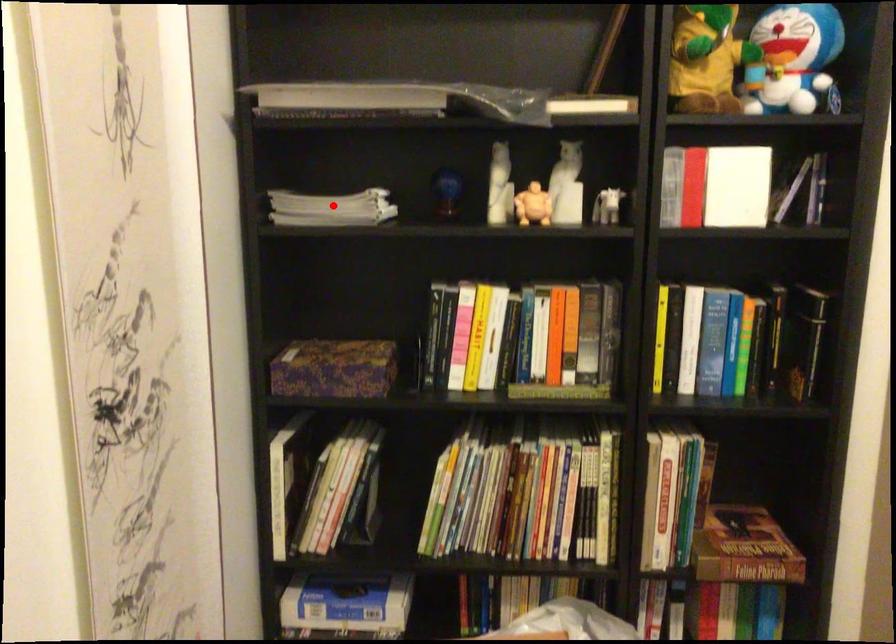
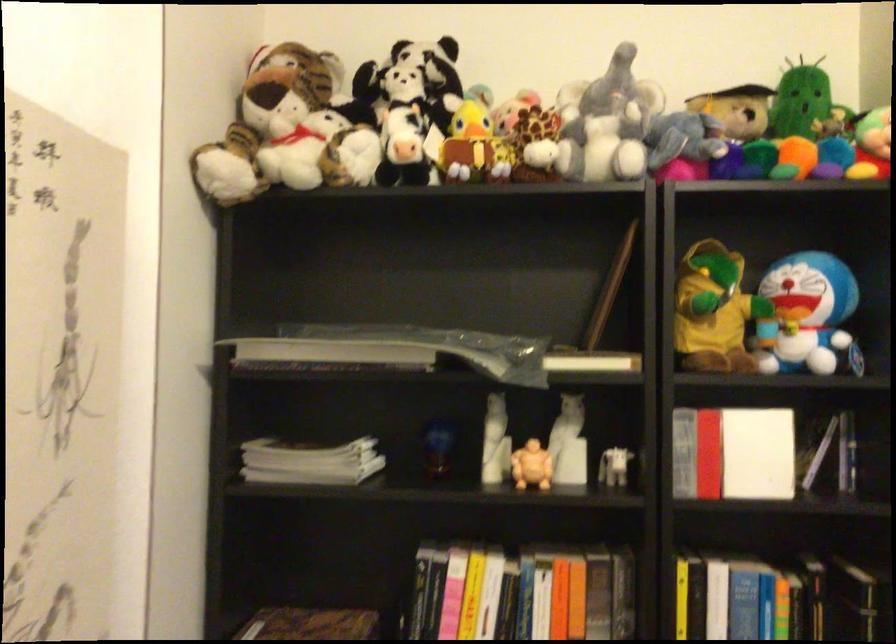
In the second image, find the point that corresponds to the highlighted location in the first image.

(309, 462)